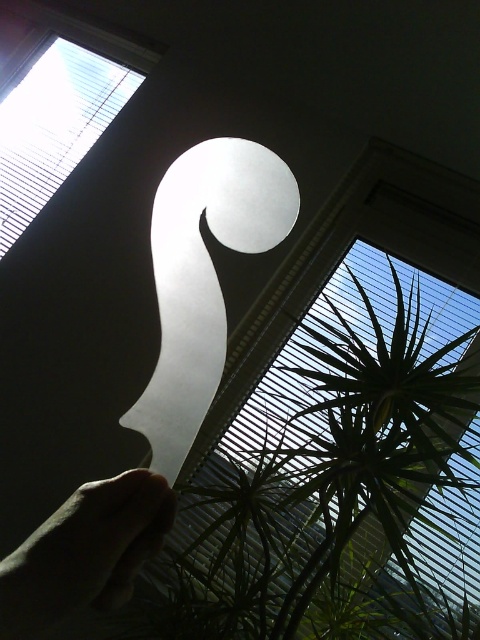
Is skinny flesh-toned hand at lower left smaller than white matte blind at upper left?

Yes.

Is point (164, 509) positioned in front of point (13, 99)?

Yes, it is.

Locate an element on the screen. skinny flesh-toned hand at lower left is located at coordinates (84, 552).

Consider the image. Which is below, green translucent blind at upper center or skinny flesh-toned hand at lower left?

green translucent blind at upper center

Is green translucent blind at upper center above skinny flesh-toned hand at lower left?

Incorrect, green translucent blind at upper center is not positioned above skinny flesh-toned hand at lower left.

Is point (424, 444) less distant than point (165, 513)?

No, (424, 444) is behind (165, 513).

Image resolution: width=480 pixels, height=640 pixels. I want to click on green translucent blind at upper center, so click(x=326, y=461).

Can you confirm if green translucent blind at upper center is wider than white matte blind at upper left?

Yes.

Which is behind, point (476, 403) or point (52, 145)?

Point (52, 145)

The height and width of the screenshot is (640, 480). I want to click on green translucent blind at upper center, so click(326, 461).